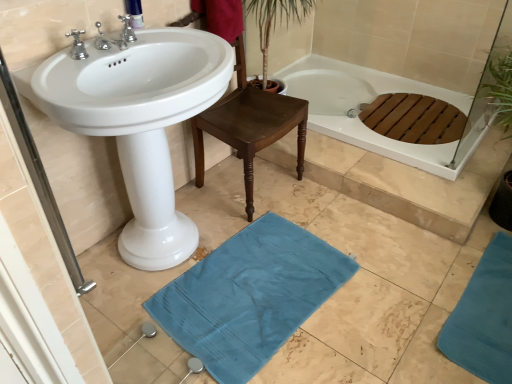
Question: Is polished chrome faucet at upper center, which appears as the second tap when viewed from the front, situated inside white glossy sink at center or outside?

Choices:
 (A) inside
 (B) outside

Answer: (B)

Question: From the image's perspective, is polished chrome faucet at upper center, which appears as the second tap when viewed from the front, located above or below white glossy sink at center?

Choices:
 (A) above
 (B) below

Answer: (A)

Question: Which object is the closest to the white glossy sink at center?

Choices:
 (A) polished chrome faucet at upper center, which appears as the second tap when viewed from the front
 (B) blue fabric bath mat at lower center, the second bath mat viewed from the right
 (C) white glossy bathtub at upper right
 (D) teal fabric bath mat at lower right, the second bath mat when ordered from left to right
 (E) satin nickel faucet at upper left, the 2th tap positioned from the back

Answer: (E)

Question: Which is farther from the satin nickel faucet at upper left, acting as the first tap starting from the front?

Choices:
 (A) white glossy sink at center
 (B) polished chrome faucet at upper center, which appears as the second tap when viewed from the front
 (C) teal fabric bath mat at lower right, the second bath mat when ordered from left to right
 (D) blue fabric bath mat at lower center, the 1th bath mat when ordered from left to right
 (E) blue cotton beach towel at upper center

Answer: (C)